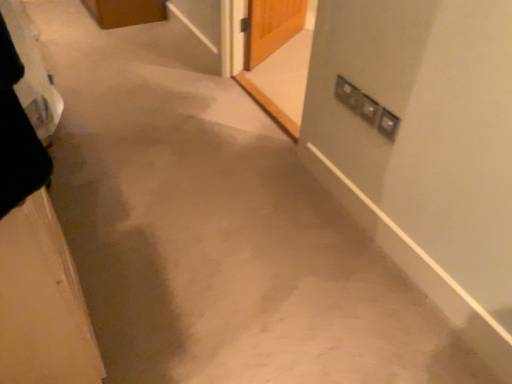
Question: Considering the relative sizes of satin silver switch at upper right and matte silver screen door at upper right, the first screen door positioned from the front, in the image provided, is satin silver switch at upper right taller than matte silver screen door at upper right, the first screen door positioned from the front,?

Choices:
 (A) yes
 (B) no

Answer: (B)

Question: Is there a large distance between satin silver switch at upper right and matte silver screen door at upper right, the first screen door positioned from the front?

Choices:
 (A) no
 (B) yes

Answer: (B)

Question: Can you confirm if satin silver switch at upper right is shorter than matte silver screen door at upper right, the second screen door viewed from the back?

Choices:
 (A) yes
 (B) no

Answer: (A)

Question: Is the depth of satin silver switch at upper right greater than that of matte silver screen door at upper right, the first screen door positioned from the front?

Choices:
 (A) no
 (B) yes

Answer: (A)

Question: From a real-world perspective, is satin silver switch at upper right below matte silver screen door at upper right, the 2th screen door positioned from the left?

Choices:
 (A) yes
 (B) no

Answer: (B)

Question: In the image, is wooden door at left positioned in front of or behind matte silver screen door at upper right, the second screen door viewed from the back?

Choices:
 (A) front
 (B) behind

Answer: (A)

Question: From the image's perspective, relative to matte silver screen door at upper right, the first screen door positioned from the front, is wooden door at left above or below?

Choices:
 (A) below
 (B) above

Answer: (A)

Question: Is wooden door at left taller or shorter than matte silver screen door at upper right, marked as the first screen door in a right-to-left arrangement?

Choices:
 (A) tall
 (B) short

Answer: (B)

Question: Is point (45, 352) positioned closer to the camera than point (307, 72)?

Choices:
 (A) closer
 (B) farther

Answer: (A)

Question: Is transparent glass screen door at upper center, the 1th screen door from the back, wider or thinner than satin silver switch at upper right?

Choices:
 (A) wide
 (B) thin

Answer: (A)

Question: Considering the relative positions of transparent glass screen door at upper center, the second screen door in the right-to-left sequence, and satin silver switch at upper right in the image provided, is transparent glass screen door at upper center, the second screen door in the right-to-left sequence, to the left or to the right of satin silver switch at upper right?

Choices:
 (A) right
 (B) left

Answer: (B)

Question: Is transparent glass screen door at upper center, arranged as the 2th screen door when viewed from the front, situated inside satin silver switch at upper right or outside?

Choices:
 (A) inside
 (B) outside

Answer: (B)

Question: In terms of size, does transparent glass screen door at upper center, which is counted as the 1th screen door, starting from the left, appear bigger or smaller than satin silver switch at upper right?

Choices:
 (A) small
 (B) big

Answer: (B)

Question: Would you say matte silver screen door at upper right, the first screen door positioned from the front, is to the left or to the right of transparent glass screen door at upper center, the second screen door in the right-to-left sequence, in the picture?

Choices:
 (A) right
 (B) left

Answer: (A)

Question: Based on their sizes in the image, would you say matte silver screen door at upper right, marked as the first screen door in a right-to-left arrangement, is bigger or smaller than transparent glass screen door at upper center, which is counted as the 1th screen door, starting from the left?

Choices:
 (A) big
 (B) small

Answer: (A)